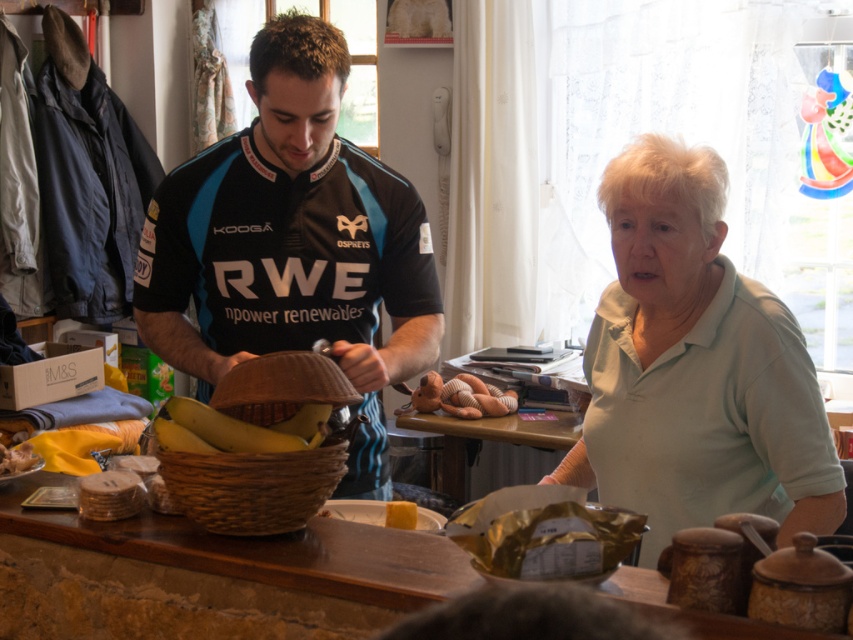
You are standing at the counter in the image. There are two points marked on the floor. One is at point (798, 525) and the other at point (296, 604). Which point is closer to you?

Point (296, 604) is closer to you because it is in front of point (798, 525).

You are a customer at the cafe and want to place a small, 10cm wide book on the counter. The yellow matte bananas at center and the yellow wax candle at center are already occupying space. Which object should you move to make room for the book?

The yellow wax candle at center has a smaller width than the yellow matte bananas at center, so moving the yellow wax candle at center would be easier to make space for the book.